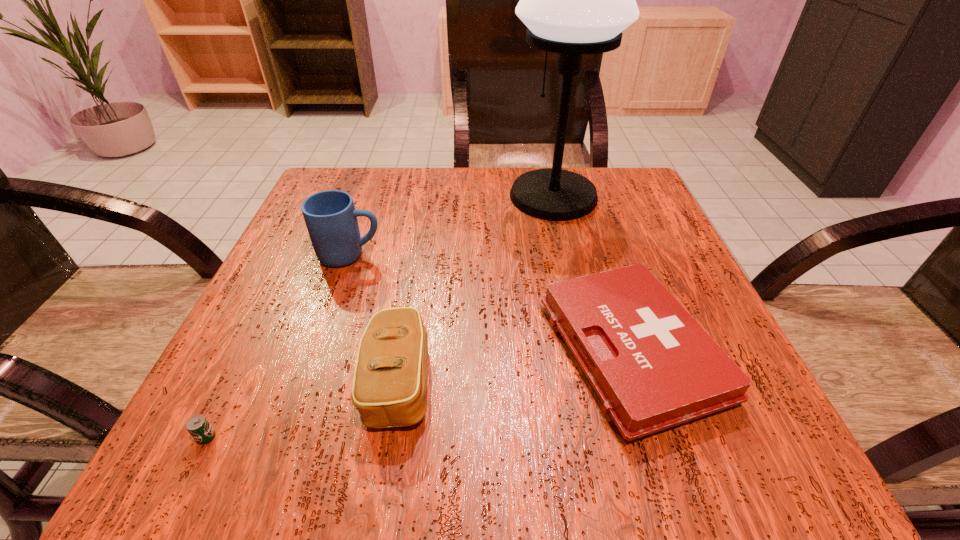
The image size is (960, 540). What are the coordinates of `vacant space at the near left corner of the desktop` in the screenshot? It's located at (282, 447).

Find the location of a particular element. The image size is (960, 540). free space at the near right corner of the desktop is located at coordinates (711, 450).

Image resolution: width=960 pixels, height=540 pixels. Identify the location of blank region between the fourth nearest object and the shortest object. (278, 346).

Where is `free spot between the tallest object and the second shortest object`? This screenshot has width=960, height=540. free spot between the tallest object and the second shortest object is located at coordinates coord(592,274).

The height and width of the screenshot is (540, 960). Find the location of `empty space between the first-aid kit and the third object from right to left`. empty space between the first-aid kit and the third object from right to left is located at coordinates (515, 366).

Where is `blank region between the second object from left to right and the farthest object`? The width and height of the screenshot is (960, 540). blank region between the second object from left to right and the farthest object is located at coordinates (452, 226).

Where is `free space between the third object from right to left and the farthest object`? The width and height of the screenshot is (960, 540). free space between the third object from right to left and the farthest object is located at coordinates (476, 289).

Locate an element on the screen. The image size is (960, 540). free space that is in between the first-aid kit and the third object from left to right is located at coordinates (515, 366).

Find the location of a particular element. This screenshot has width=960, height=540. object that is the fourth closest to the clutch bag is located at coordinates (575, 0).

Choose which object is the nearest neighbor to the table lamp. Please provide its 2D coordinates. Your answer should be formatted as a tuple, i.e. [(x, y)], where the tuple contains the x and y coordinates of a point satisfying the conditions above.

[(652, 366)]